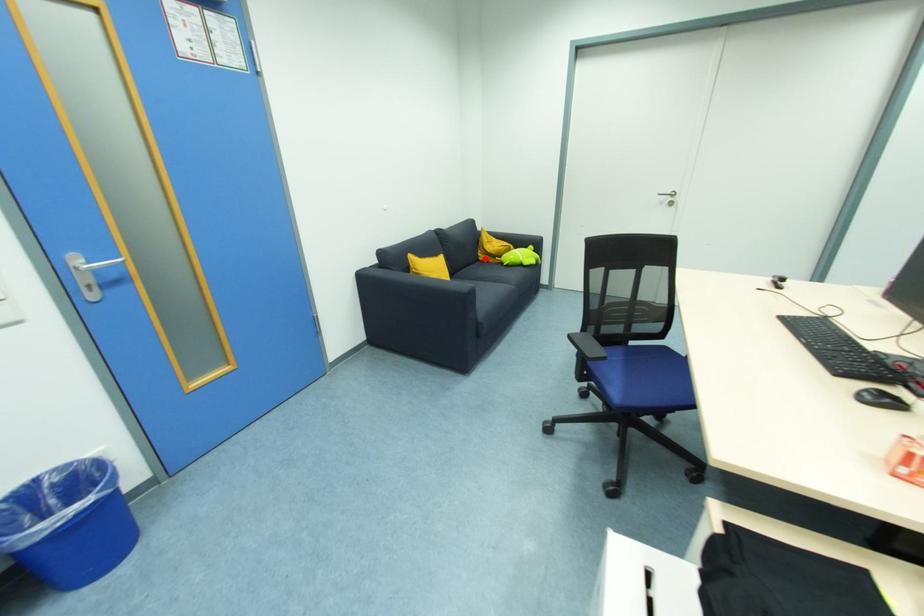
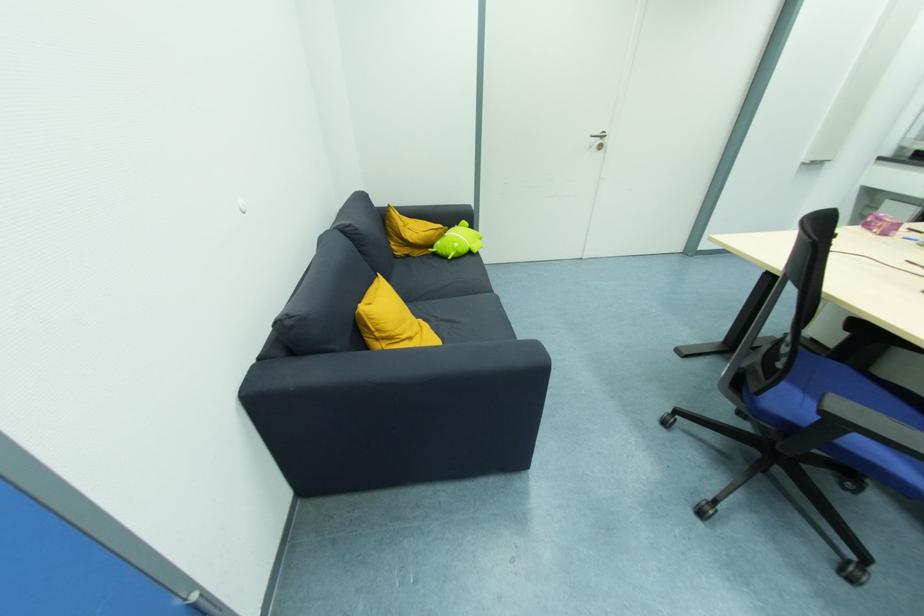
Where in the second image is the point corresponding to the highlighted location from the first image?

(403, 253)